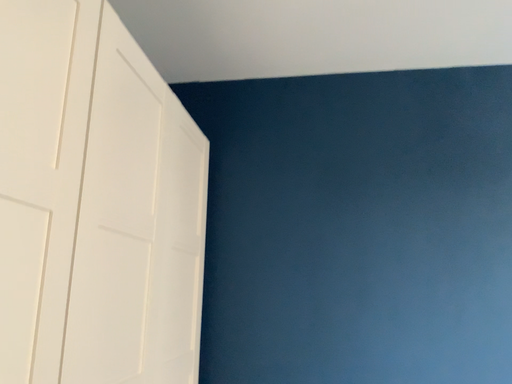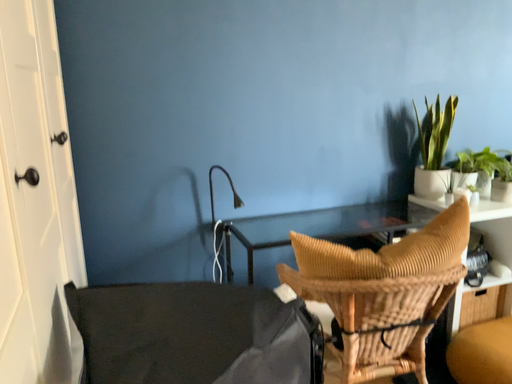
Question: How did the camera likely rotate when shooting the video?

Choices:
 (A) rotated upward
 (B) rotated downward

Answer: (B)